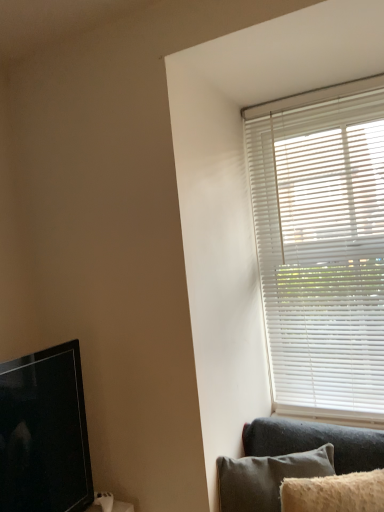
Find the location of a particular element. fuzzy beige pillow at lower right is located at coordinates (334, 493).

The height and width of the screenshot is (512, 384). Describe the element at coordinates (44, 433) in the screenshot. I see `black glossy tv at left` at that location.

The image size is (384, 512). Describe the element at coordinates (291, 459) in the screenshot. I see `dark gray fabric couch at lower right` at that location.

Locate an element on the screen. white matte blinds at upper right is located at coordinates 322,247.

The height and width of the screenshot is (512, 384). Identify the location of fuzzy beige pillow at lower right. (334, 493).

Consider the image. Is dark gray fabric couch at lower right to the left of fuzzy beige pillow at lower right from the viewer's perspective?

Yes.

Could fuzzy beige pillow at lower right be considered to be inside dark gray fabric couch at lower right?

No, dark gray fabric couch at lower right does not contain fuzzy beige pillow at lower right.

Does dark gray fabric couch at lower right come behind fuzzy beige pillow at lower right?

That is True.

From a real-world perspective, between dark gray fabric couch at lower right and fuzzy beige pillow at lower right, who is vertically higher?

In real-world perspective, fuzzy beige pillow at lower right is above.

From the picture: Can you tell me how much fuzzy beige pillow at lower right and dark gray fabric couch at lower right differ in facing direction?

The angle between the facing direction of fuzzy beige pillow at lower right and the facing direction of dark gray fabric couch at lower right is 9.43 degrees.

In the image, is fuzzy beige pillow at lower right on the left side or the right side of dark gray fabric couch at lower right?

fuzzy beige pillow at lower right is positioned on dark gray fabric couch at lower right's right side.

Is fuzzy beige pillow at lower right oriented towards dark gray fabric couch at lower right?

No, fuzzy beige pillow at lower right is not oriented towards dark gray fabric couch at lower right.

Which point is more forward, (337,507) or (331,449)?

Positioned in front is point (337,507).

Based on the photo, considering the sizes of white matte blinds at upper right and dark gray fabric couch at lower right in the image, is white matte blinds at upper right bigger or smaller than dark gray fabric couch at lower right?

In the image, white matte blinds at upper right appears to be larger than dark gray fabric couch at lower right.

Where is `window blind that appears above the dark gray fabric couch at lower right (from a real-world perspective)`? The width and height of the screenshot is (384, 512). window blind that appears above the dark gray fabric couch at lower right (from a real-world perspective) is located at coordinates (322, 247).

Is white matte blinds at upper right aimed at dark gray fabric couch at lower right?

Yes, white matte blinds at upper right is oriented towards dark gray fabric couch at lower right.

From a real-world perspective, is black glossy tv at left physically above dark gray fabric couch at lower right?

Correct, in the physical world, black glossy tv at left is higher than dark gray fabric couch at lower right.

Considering the sizes of black glossy tv at left and dark gray fabric couch at lower right in the image, is black glossy tv at left taller or shorter than dark gray fabric couch at lower right?

Clearly, black glossy tv at left is taller compared to dark gray fabric couch at lower right.

This screenshot has width=384, height=512. What are the coordinates of `television on the left of dark gray fabric couch at lower right` in the screenshot? It's located at (44, 433).

How many degrees apart are the facing directions of black glossy tv at left and dark gray fabric couch at lower right?

The angle between the facing direction of black glossy tv at left and the facing direction of dark gray fabric couch at lower right is 59.1 degrees.

Would you say white matte blinds at upper right is a long distance from black glossy tv at left?

Answer: white matte blinds at upper right is far away from black glossy tv at left.

Can you tell me how much white matte blinds at upper right and black glossy tv at left differ in facing direction?

They differ by 88.4 degrees in their facing directions.

The width and height of the screenshot is (384, 512). What are the coordinates of `window blind above the black glossy tv at left (from the image's perspective)` in the screenshot? It's located at (322, 247).

Is point (332, 506) closer or farther from the camera than point (60, 452)?

Point (332, 506).

Is fuzzy beige pillow at lower right far from black glossy tv at left?

Actually, fuzzy beige pillow at lower right and black glossy tv at left are a little close together.

Is fuzzy beige pillow at lower right facing towards black glossy tv at left?

No, fuzzy beige pillow at lower right is not aimed at black glossy tv at left.

Considering the sizes of objects fuzzy beige pillow at lower right and black glossy tv at left in the image provided, who is wider, fuzzy beige pillow at lower right or black glossy tv at left?

black glossy tv at left is wider.

How much distance is there between black glossy tv at left and fuzzy beige pillow at lower right?

A distance of 34.57 inches exists between black glossy tv at left and fuzzy beige pillow at lower right.

Can you confirm if black glossy tv at left is bigger than fuzzy beige pillow at lower right?

Indeed, black glossy tv at left has a larger size compared to fuzzy beige pillow at lower right.

Considering the points (3, 444) and (364, 483), which point is in front, point (3, 444) or point (364, 483)?

The point (3, 444) is more forward.

Looking at this image, is black glossy tv at left at the left side of fuzzy beige pillow at lower right?

Yes.

I want to click on pillow on the right of dark gray fabric couch at lower right, so click(x=334, y=493).

The width and height of the screenshot is (384, 512). What are the coordinates of `pillow that appears above the dark gray fabric couch at lower right (from a real-world perspective)` in the screenshot? It's located at (334, 493).

Considering their positions, is dark gray fabric couch at lower right positioned closer to black glossy tv at left than white matte blinds at upper right?

dark gray fabric couch at lower right is positioned closer to the anchor black glossy tv at left.

From the image, which object appears to be farther from fuzzy beige pillow at lower right, white matte blinds at upper right or dark gray fabric couch at lower right?

The object further to fuzzy beige pillow at lower right is white matte blinds at upper right.

Estimate the real-world distances between objects in this image. Which object is further from white matte blinds at upper right, dark gray fabric couch at lower right or fuzzy beige pillow at lower right?

fuzzy beige pillow at lower right lies further to white matte blinds at upper right than the other object.

Which object lies further to the anchor point white matte blinds at upper right, dark gray fabric couch at lower right or black glossy tv at left?

black glossy tv at left lies further to white matte blinds at upper right than the other object.

From the image, which object appears to be nearer to white matte blinds at upper right, black glossy tv at left or fuzzy beige pillow at lower right?

The object closer to white matte blinds at upper right is fuzzy beige pillow at lower right.

Based on their spatial positions, is black glossy tv at left or white matte blinds at upper right further from dark gray fabric couch at lower right?

The object further to dark gray fabric couch at lower right is black glossy tv at left.

Estimate the real-world distances between objects in this image. Which object is closer to black glossy tv at left, white matte blinds at upper right or dark gray fabric couch at lower right?

dark gray fabric couch at lower right is closer to black glossy tv at left.

Based on the photo, when comparing their distances from black glossy tv at left, does white matte blinds at upper right or fuzzy beige pillow at lower right seem closer?

fuzzy beige pillow at lower right is closer to black glossy tv at left.

Where is `studio couch located between black glossy tv at left and white matte blinds at upper right in the left-right direction`? studio couch located between black glossy tv at left and white matte blinds at upper right in the left-right direction is located at coordinates (291, 459).

Where is `studio couch between black glossy tv at left and fuzzy beige pillow at lower right`? studio couch between black glossy tv at left and fuzzy beige pillow at lower right is located at coordinates pyautogui.click(x=291, y=459).

Find the location of a particular element. This screenshot has width=384, height=512. pillow between white matte blinds at upper right and dark gray fabric couch at lower right in the vertical direction is located at coordinates (334, 493).

You are a GUI agent. You are given a task and a screenshot of the screen. Output one action in this format:
    pyautogui.click(x=<x>, y=<y>)
    Task: Click on the pillow between black glossy tv at left and white matte blinds at upper right
    The image size is (384, 512).
    Given the screenshot: What is the action you would take?
    pyautogui.click(x=334, y=493)